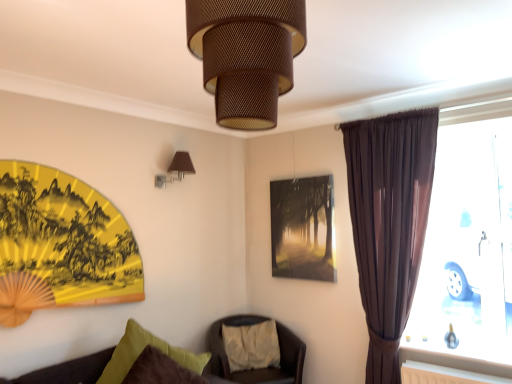
Question: From a real-world perspective, is white cotton pillow at center, which is the second pillow from front to back, on velvet green pillow at lower left, the 1th pillow from the front?

Choices:
 (A) yes
 (B) no

Answer: (B)

Question: From the image's perspective, is white cotton pillow at center, which is the second pillow from front to back, beneath velvet green pillow at lower left, positioned as the 2th pillow in back-to-front order?

Choices:
 (A) yes
 (B) no

Answer: (A)

Question: Does white cotton pillow at center, marked as the 1th pillow in a right-to-left arrangement, contain velvet green pillow at lower left, arranged as the second pillow when viewed from the right?

Choices:
 (A) yes
 (B) no

Answer: (B)

Question: Is white cotton pillow at center, the 2th pillow when ordered from left to right, far from velvet green pillow at lower left, positioned as the 2th pillow in back-to-front order?

Choices:
 (A) yes
 (B) no

Answer: (B)

Question: Are white cotton pillow at center, which is the second pillow from front to back, and velvet green pillow at lower left, positioned as the 2th pillow in back-to-front order, beside each other?

Choices:
 (A) yes
 (B) no

Answer: (B)

Question: Is matte glass picture frame at center spatially inside satin brown curtain at right, or outside of it?

Choices:
 (A) inside
 (B) outside

Answer: (B)

Question: Considering the positions of matte glass picture frame at center and satin brown curtain at right in the image, is matte glass picture frame at center wider or thinner than satin brown curtain at right?

Choices:
 (A) thin
 (B) wide

Answer: (A)

Question: Is point (312, 198) closer or farther from the camera than point (486, 301)?

Choices:
 (A) closer
 (B) farther

Answer: (B)

Question: Looking at the image, does matte glass picture frame at center seem bigger or smaller compared to satin brown curtain at right?

Choices:
 (A) big
 (B) small

Answer: (B)

Question: From the image's perspective, relative to brown textured lampshade at upper center, the 2th lamp positioned from the back, is brown leather chair at center above or below?

Choices:
 (A) below
 (B) above

Answer: (A)

Question: Relative to brown textured lampshade at upper center, the 2th lamp positioned from the back, is brown leather chair at center in front or behind?

Choices:
 (A) behind
 (B) front

Answer: (A)

Question: Is brown leather chair at center bigger or smaller than brown textured lampshade at upper center, placed as the second lamp when sorted from left to right?

Choices:
 (A) small
 (B) big

Answer: (B)

Question: Does point (206, 342) appear closer or farther from the camera than point (300, 6)?

Choices:
 (A) farther
 (B) closer

Answer: (A)

Question: Which is correct: satin brown curtain at right is inside brown leather chair at center, or outside of it?

Choices:
 (A) outside
 (B) inside

Answer: (A)

Question: Relative to brown leather chair at center, is satin brown curtain at right in front or behind?

Choices:
 (A) front
 (B) behind

Answer: (A)